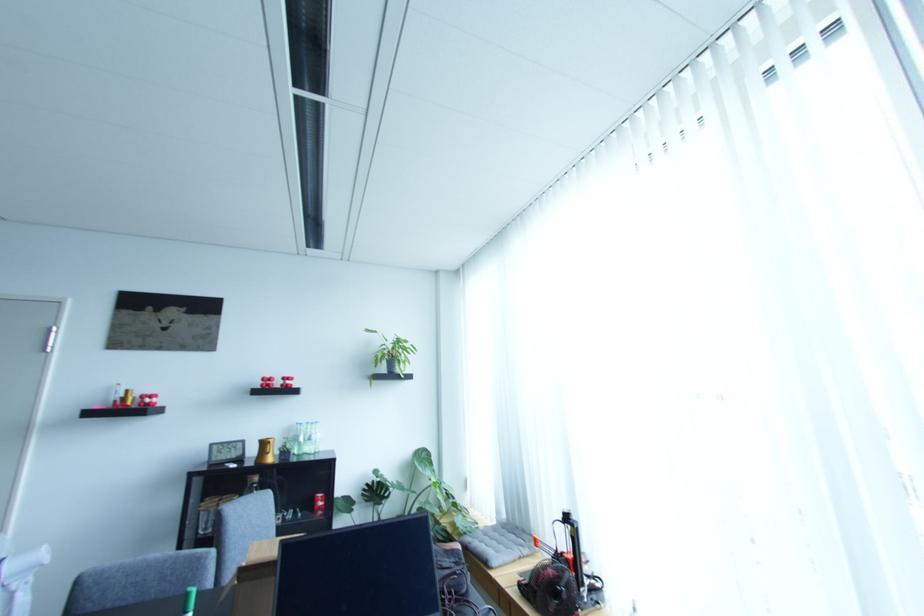
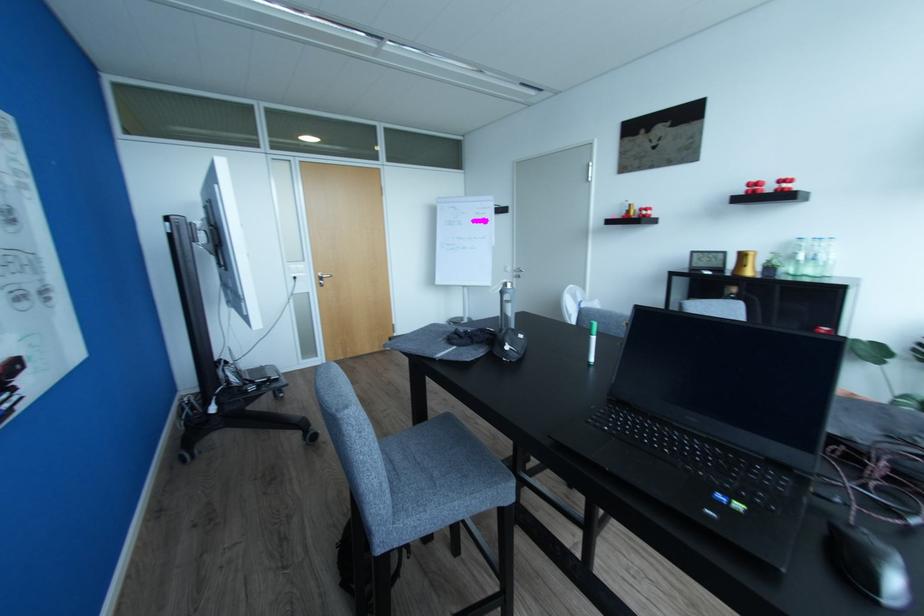
In the second image, find the point that corresponds to point (292, 377) in the first image.

(791, 177)